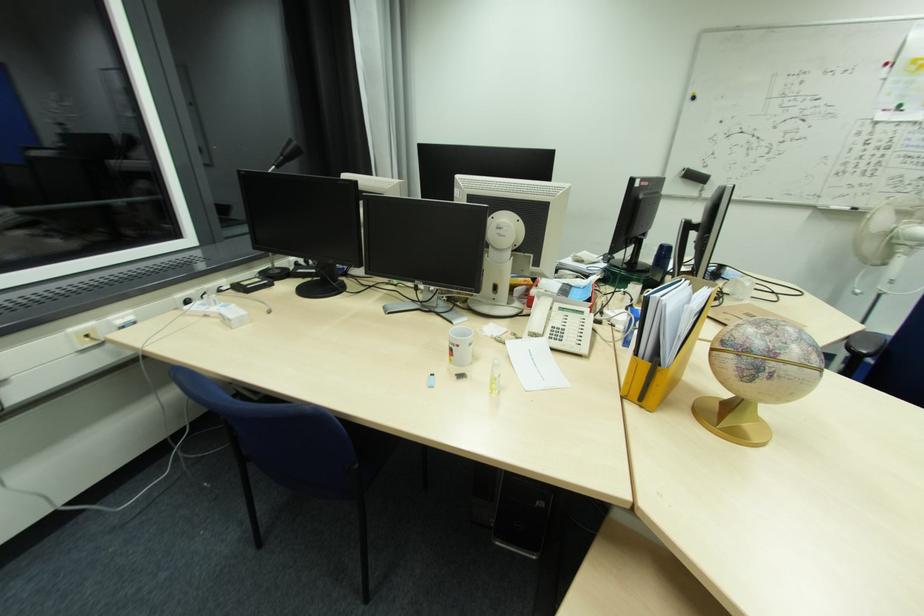
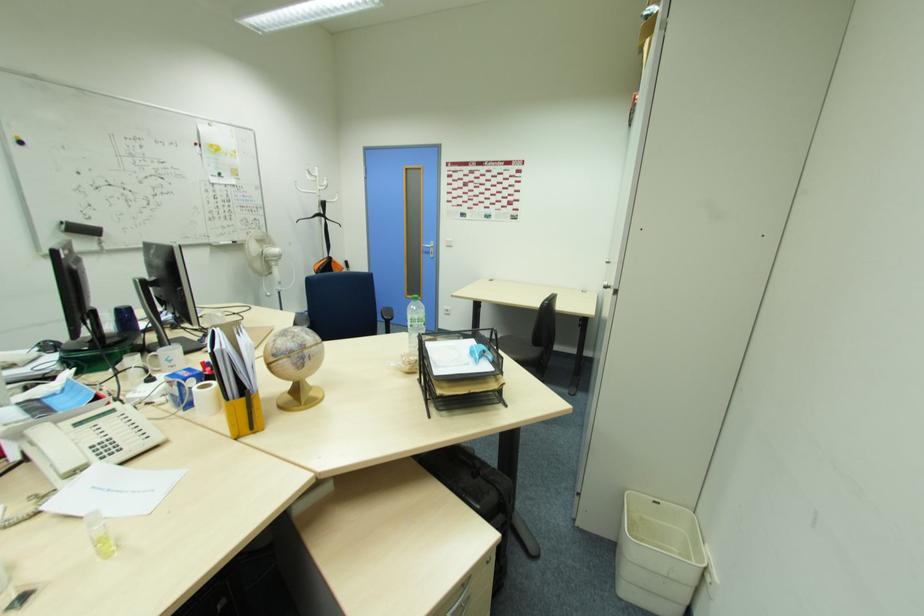
Locate, in the second image, the point that corresponds to (x=667, y=253) in the first image.

(128, 315)